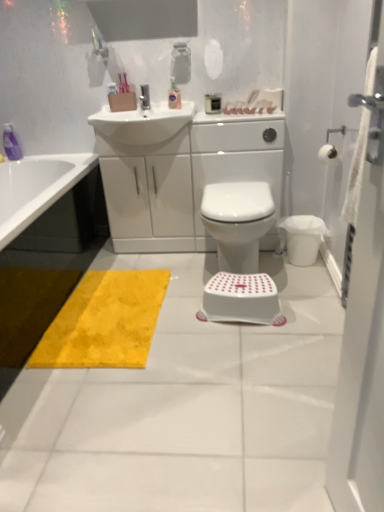
Locate an element on the screen. vacant space to the left of white plastic step stool at center is located at coordinates click(x=186, y=318).